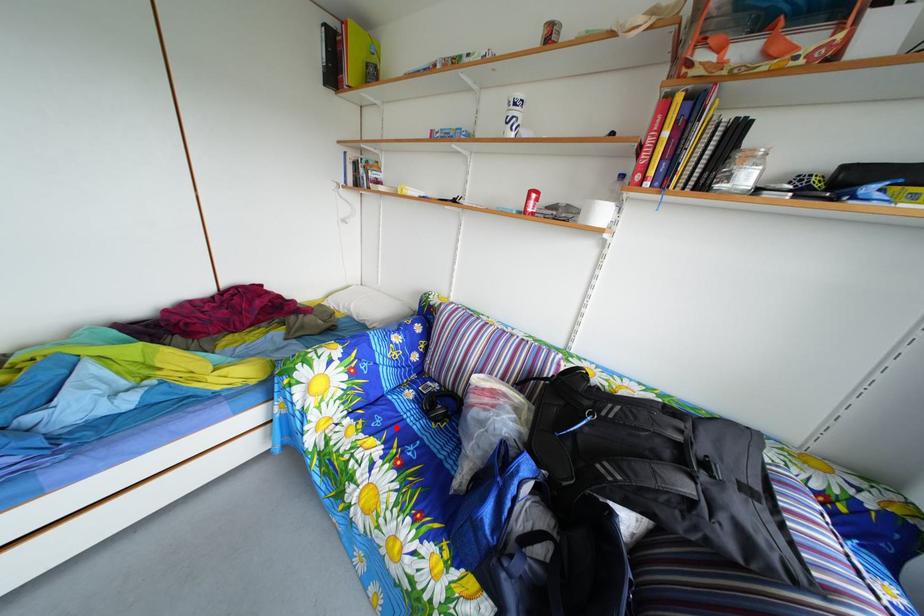
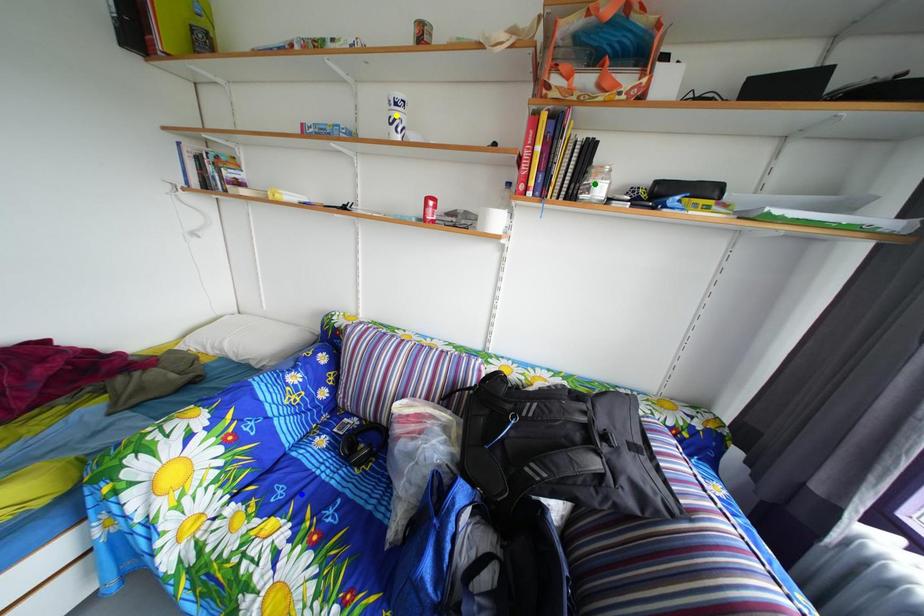
Question: I am providing you with two images of the same scene from different viewpoints. A red point is marked on the first image. You are given multiple points on the second image. Which point in image 2 is actually the same real-world point as the red point in image 1?

Choices:
 (A) blue point
 (B) yellow point
 (C) green point

Answer: (A)